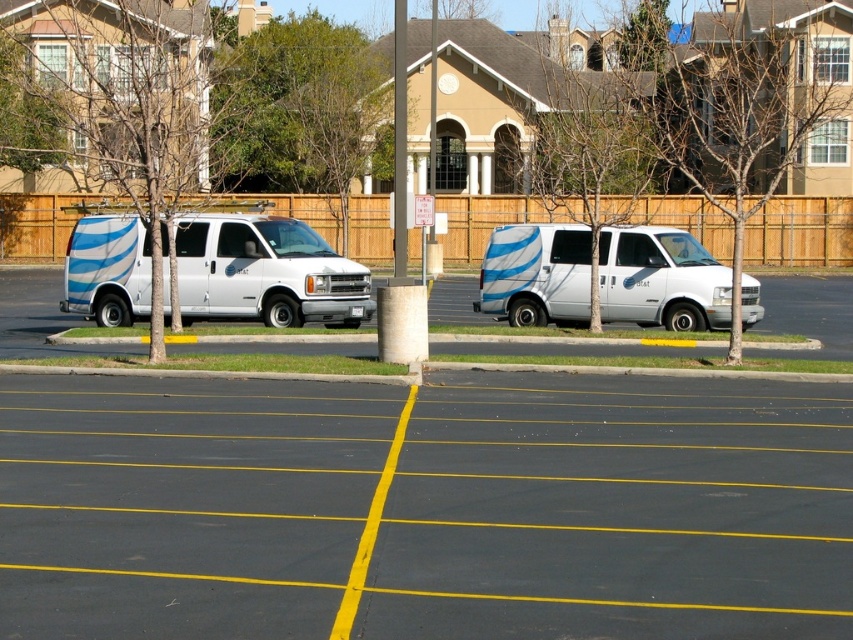
Question: Which of the following is the farthest from the observer?

Choices:
 (A) white matte van at left
 (B) white glossy van at left

Answer: (B)

Question: Which point is farther to the camera?

Choices:
 (A) white glossy van at left
 (B) white glossy van at center

Answer: (B)

Question: Does white glossy van at left appear on the right side of white glossy van at center?

Choices:
 (A) yes
 (B) no

Answer: (B)

Question: Which point is farther to the camera?

Choices:
 (A) white glossy van at left
 (B) white glossy van at center
 (C) white matte van at left

Answer: (B)

Question: Is white matte van at left thinner than white glossy van at center?

Choices:
 (A) yes
 (B) no

Answer: (B)

Question: Can you confirm if white matte van at left is bigger than white glossy van at left?

Choices:
 (A) no
 (B) yes

Answer: (B)